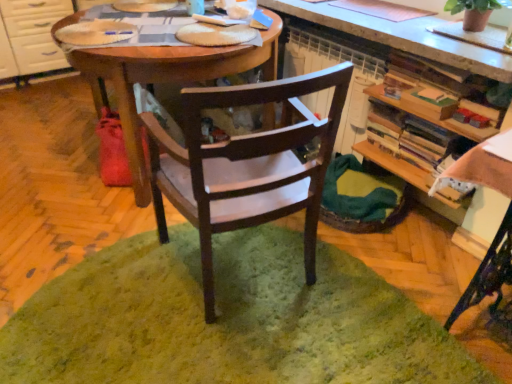
The height and width of the screenshot is (384, 512). Find the location of `free space on the front side of mahogany wood chair at center`. free space on the front side of mahogany wood chair at center is located at coordinates (246, 344).